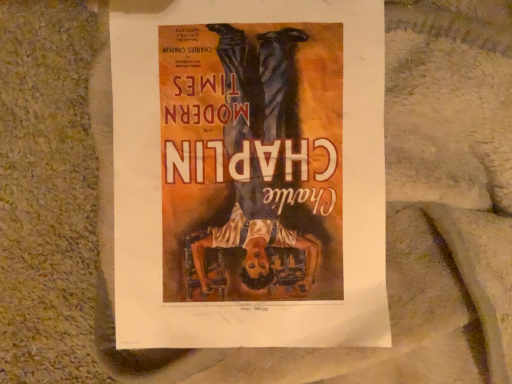
Locate an element on the screen. This screenshot has width=512, height=384. matte paper poster at center is located at coordinates (249, 173).

This screenshot has height=384, width=512. Describe the element at coordinates (249, 173) in the screenshot. I see `matte paper poster at center` at that location.

Where is `matte paper poster at center`? Image resolution: width=512 pixels, height=384 pixels. matte paper poster at center is located at coordinates (249, 173).